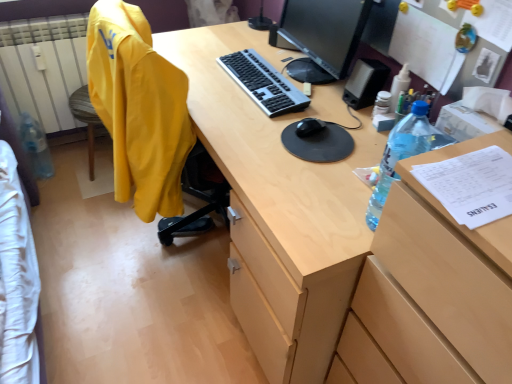
The image size is (512, 384). Find the location of `free space between black matte mouse at center and silver/black plastic keyboard at center`. free space between black matte mouse at center and silver/black plastic keyboard at center is located at coordinates (294, 111).